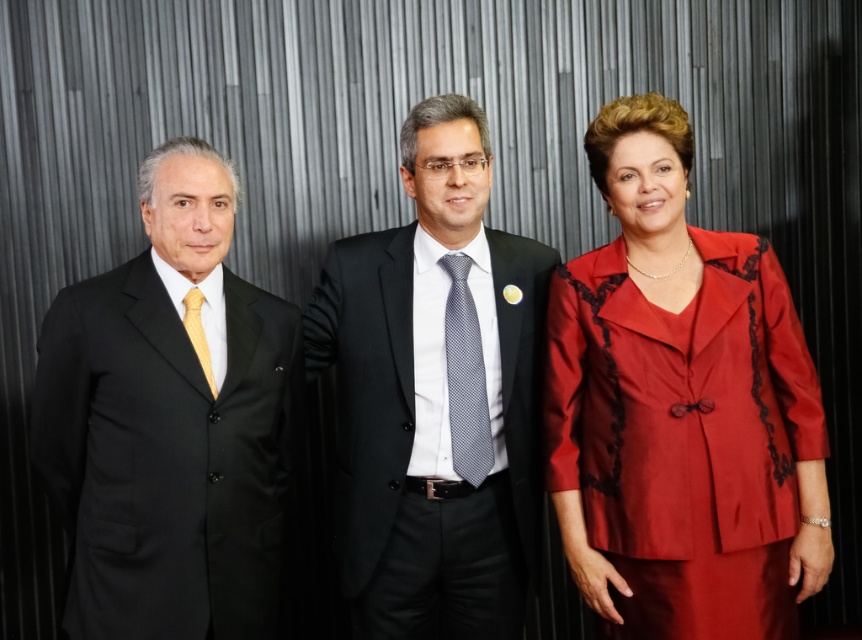
You are a photographer trying to capture a group photo of the three individuals. You need to arrange them so that the gray dotted tie at center and the matte gold tie at left are visible in the frame. Based on their current positions, which tie is closer to the right edge of the photo?

The gray dotted tie at center is positioned on the right side of the matte gold tie at left, meaning the gray dotted tie at center is closer to the right edge of the photo.

You are standing in front of the image and want to know how far the point at coordinates (463, 467) is from you. Can you determine the distance?

The point at coordinates (463, 467) is 6.02 feet away from the camera, so the distance from you to that point would be 6.02 feet.

You are standing in front of three people arranged against a striped background. You need to locate the matte black suit at center. Where exactly is it positioned in terms of coordinates?

The matte black suit at center is positioned at coordinates point (436, 396).